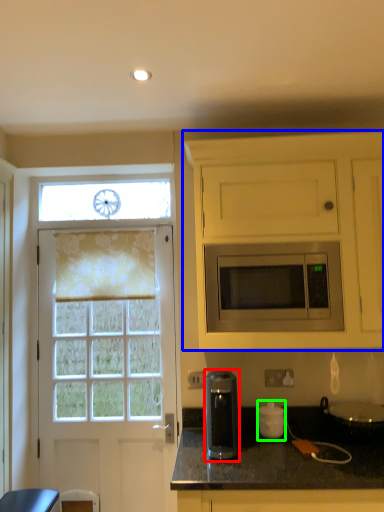
Question: Based on their relative distances, which object is farther from coffee machine (highlighted by a red box)? Choose from cabinetry (highlighted by a blue box) and appliance (highlighted by a green box).

Choices:
 (A) cabinetry
 (B) appliance

Answer: (A)